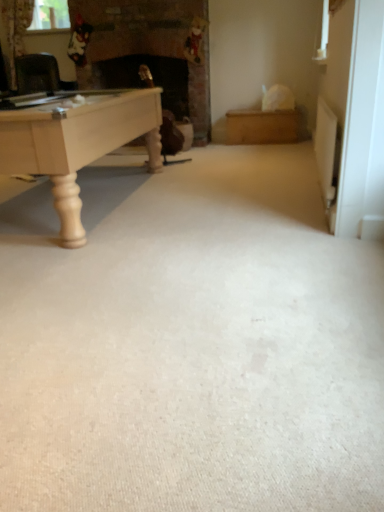
Question: Is beige carpet at center aimed at clear glass window screen at upper left?

Choices:
 (A) yes
 (B) no

Answer: (B)

Question: Is beige carpet at center at the left side of clear glass window screen at upper left?

Choices:
 (A) yes
 (B) no

Answer: (B)

Question: From a real-world perspective, is beige carpet at center positioned over clear glass window screen at upper left based on gravity?

Choices:
 (A) yes
 (B) no

Answer: (B)

Question: Does beige carpet at center contain clear glass window screen at upper left?

Choices:
 (A) yes
 (B) no

Answer: (B)

Question: Can you confirm if beige carpet at center is bigger than clear glass window screen at upper left?

Choices:
 (A) no
 (B) yes

Answer: (B)

Question: Considering the relative sizes of beige carpet at center and clear glass window screen at upper left in the image provided, is beige carpet at center wider than clear glass window screen at upper left?

Choices:
 (A) no
 (B) yes

Answer: (B)

Question: Does clear glass window screen at upper left come in front of beige carpet at center?

Choices:
 (A) yes
 (B) no

Answer: (B)

Question: From the image's perspective, does clear glass window screen at upper left appear lower than beige carpet at center?

Choices:
 (A) no
 (B) yes

Answer: (A)

Question: From the image's perspective, does clear glass window screen at upper left appear higher than beige carpet at center?

Choices:
 (A) no
 (B) yes

Answer: (B)

Question: Is there a large distance between clear glass window screen at upper left and beige carpet at center?

Choices:
 (A) no
 (B) yes

Answer: (B)

Question: From a real-world perspective, is clear glass window screen at upper left located higher than beige carpet at center?

Choices:
 (A) yes
 (B) no

Answer: (A)

Question: Is clear glass window screen at upper left looking in the opposite direction of beige carpet at center?

Choices:
 (A) yes
 (B) no

Answer: (B)

Question: From a real-world perspective, relative to clear glass window screen at upper left, is beige carpet at center vertically above or below?

Choices:
 (A) below
 (B) above

Answer: (A)